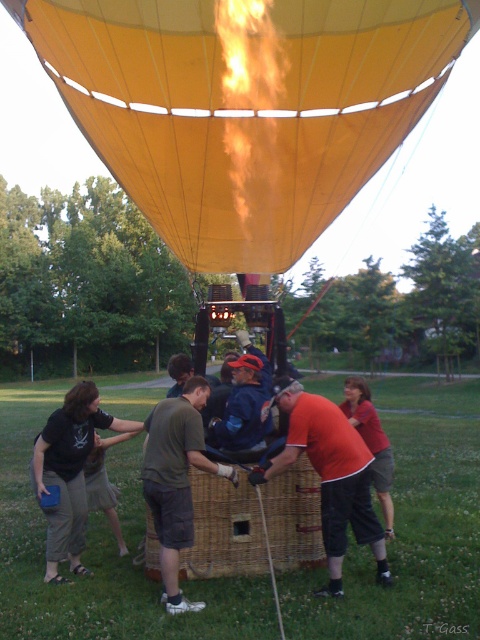
You are standing at the point labeled point (279, 13) and want to walk to the point labeled point (199, 456). Given that you can only move forward and cannot look down, will the point you are walking towards appear to get larger or smaller as you move?

The point labeled point (199, 456) will appear to get smaller as you move forward because it is farther away from the camera compared to point (279, 13). Since you are moving away from it, its apparent size decreases.